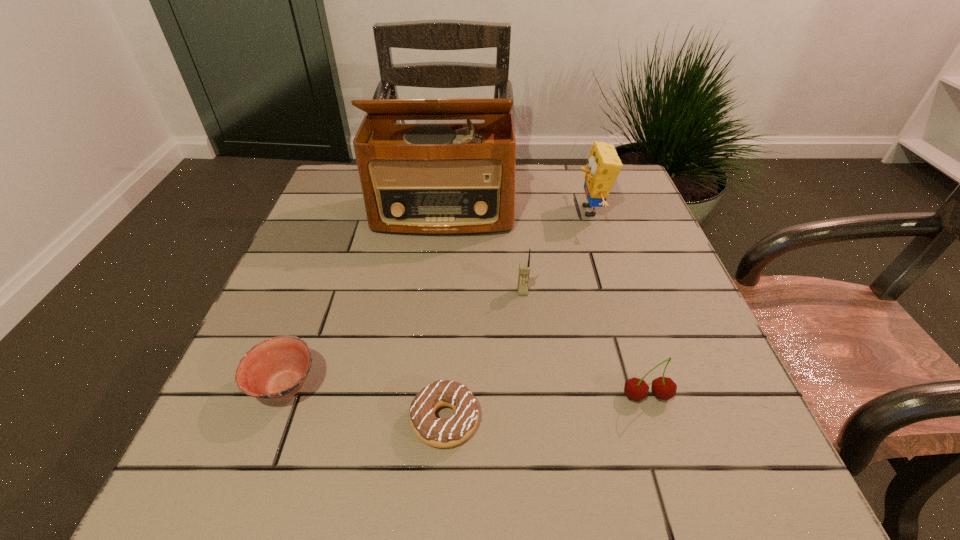
The image size is (960, 540). What are the coordinates of `cherry located in the right edge section of the desktop` in the screenshot? It's located at (664, 388).

You are a GUI agent. You are given a task and a screenshot of the screen. Output one action in this format:
    pyautogui.click(x=<x>, y=<y>)
    Task: Click on the object located in the far right corner section of the desktop
    This screenshot has height=540, width=960.
    Given the screenshot: What is the action you would take?
    pyautogui.click(x=604, y=165)

Where is `vacant area at the far edge of the desktop`? The height and width of the screenshot is (540, 960). vacant area at the far edge of the desktop is located at coordinates (573, 202).

This screenshot has height=540, width=960. Find the location of `vacant space at the near edge of the desktop`. vacant space at the near edge of the desktop is located at coordinates (x=437, y=490).

Where is `free spot at the left edge of the desktop`? free spot at the left edge of the desktop is located at coordinates (309, 239).

Image resolution: width=960 pixels, height=540 pixels. In the image, there is a desktop. In order to click on vacant region at the right edge in this screenshot , I will do `click(632, 256)`.

Find the location of `free space at the near left corner of the desktop`. free space at the near left corner of the desktop is located at coordinates (266, 448).

Locate an element on the screen. This screenshot has width=960, height=540. vacant area between the radio receiver and the leftmost object is located at coordinates (364, 300).

You are a GUI agent. You are given a task and a screenshot of the screen. Output one action in this format:
    pyautogui.click(x=<x>, y=<y>)
    Task: Click on the unoccupied position between the fifth tallest object and the fifth shortest object
    Image resolution: width=960 pixels, height=540 pixels.
    Given the screenshot: What is the action you would take?
    pyautogui.click(x=438, y=299)

Find the location of a particular element. free space between the tallest object and the fifth shortest object is located at coordinates (516, 213).